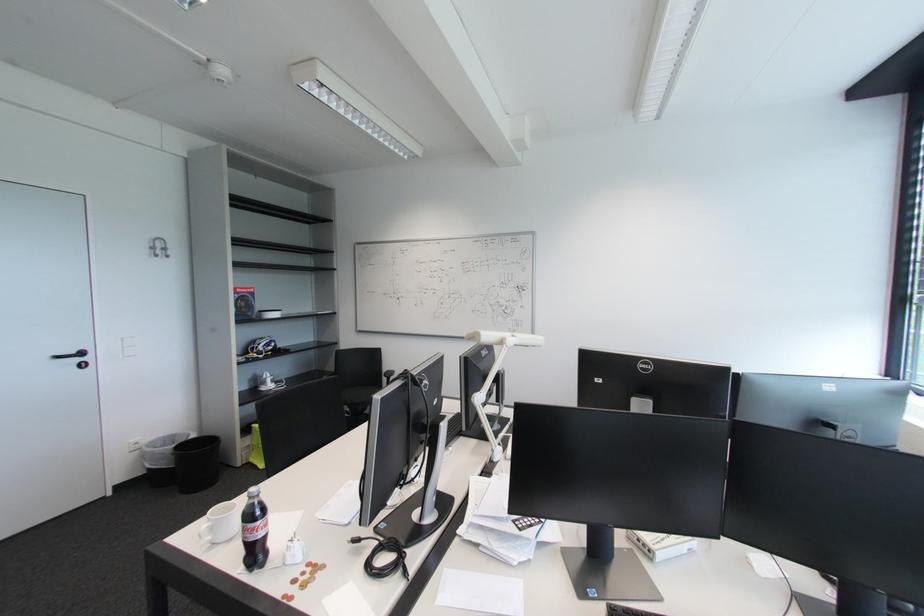
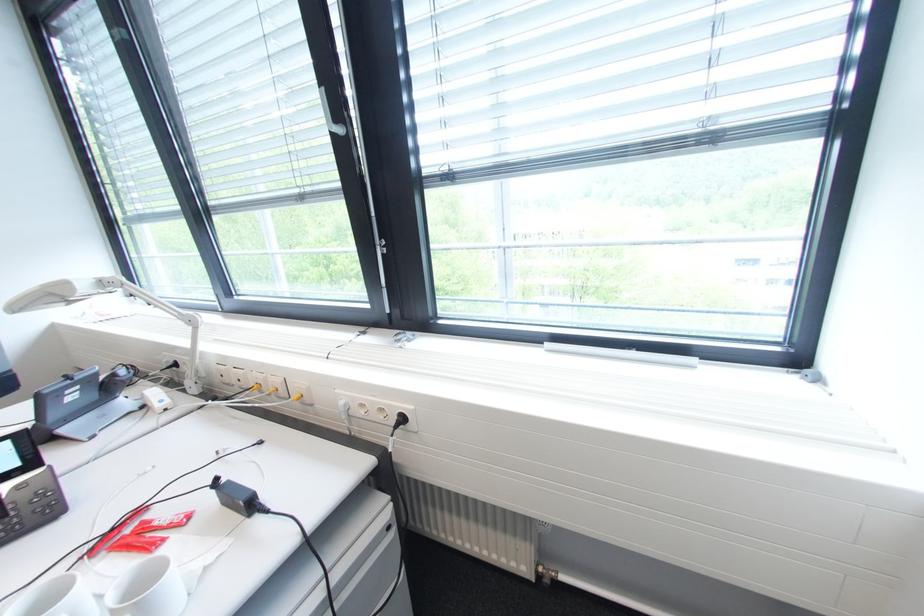
Based on the continuous images, in which direction is the camera rotating?

The camera rotated toward right-down.